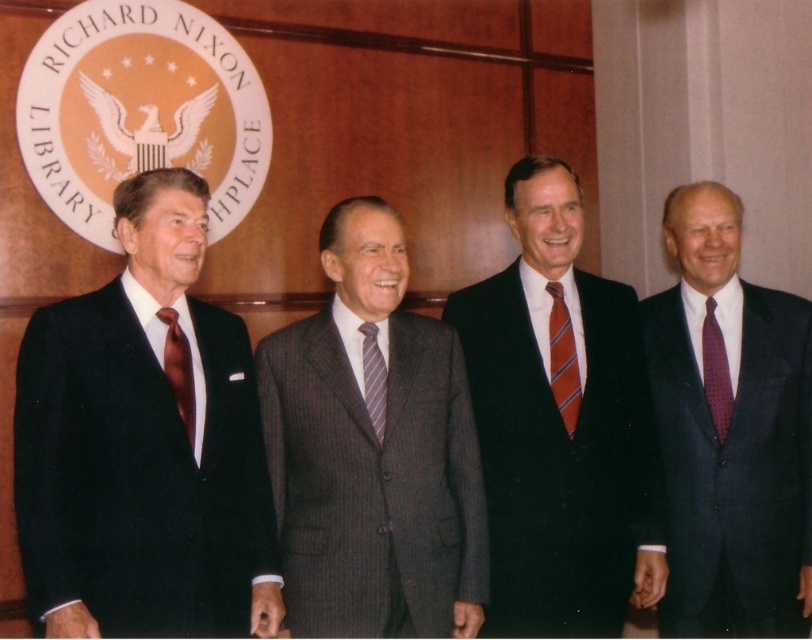
You are standing in front of the Richard Nixon Library emblem and see the gray pinstripe suit at center and the satin brown tie at left. Which object is closer to you?

The gray pinstripe suit at center is closer to you than the satin brown tie at left.

You are a photographer at the Richard Nixon Library and Museum event. You need to capture a photo where the dark blue suit at right and the striped silk tie at center are both clearly visible. Based on their positions, which one should you focus on first to ensure both are in focus?

The dark blue suit at right is further to the viewer than the striped silk tie at center. To ensure both are in focus, you should focus on the dark blue suit at right first, as it is closer to the camera, and the striped silk tie at center will naturally fall into the depth of field if focused properly.

You are a photographer at the Richard Nixon Library and Museum event. You need to capture a photo of the gray pinstripe suit at center and the satin brown tie at left. Based on their positions, which object is wider?

The gray pinstripe suit at center might be wider than the satin brown tie at left.